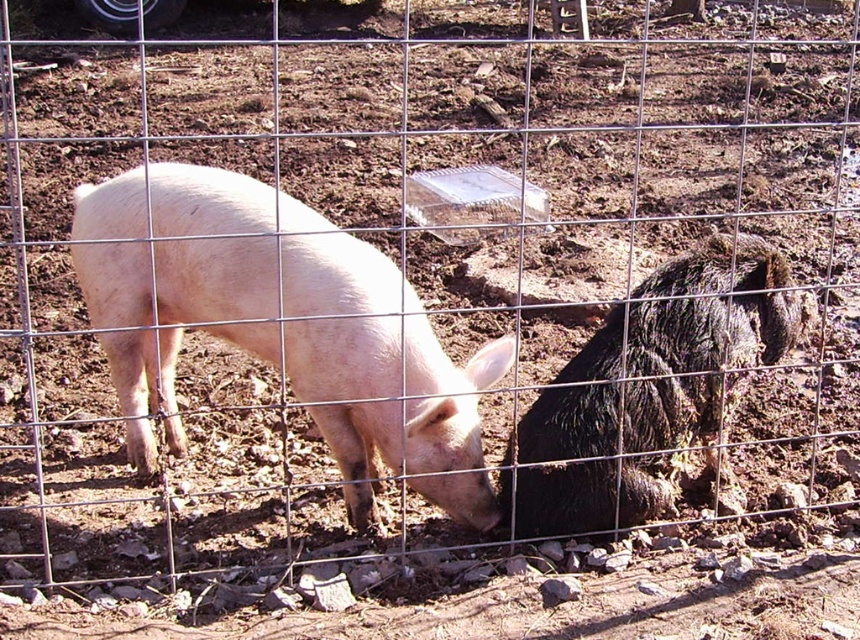
You are a farmer who needs to determine which pig requires more feed based on their size. Given that the matte pink pig at center and the shaggy black pig at right are both present, which one should you prioritize feeding more?

The matte pink pig at center is larger in size than the shaggy black pig at right, so you should prioritize feeding the matte pink pig at center more since it requires more food to maintain its size.

You are a farmer checking the pigs in the enclosure. You notice the matte pink pig at center and the shaggy black pig at right. Which pig is closer to the fence in the foreground?

The matte pink pig at center is closer to the fence in the foreground because it is in front of the shaggy black pig at right.